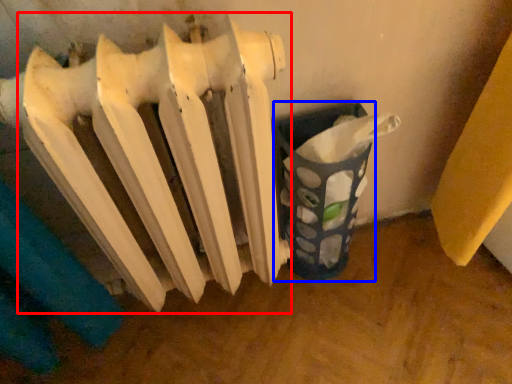
Question: Among these objects, which one is farthest to the camera, radiator (highlighted by a red box) or waste container (highlighted by a blue box)?

Choices:
 (A) radiator
 (B) waste container

Answer: (B)